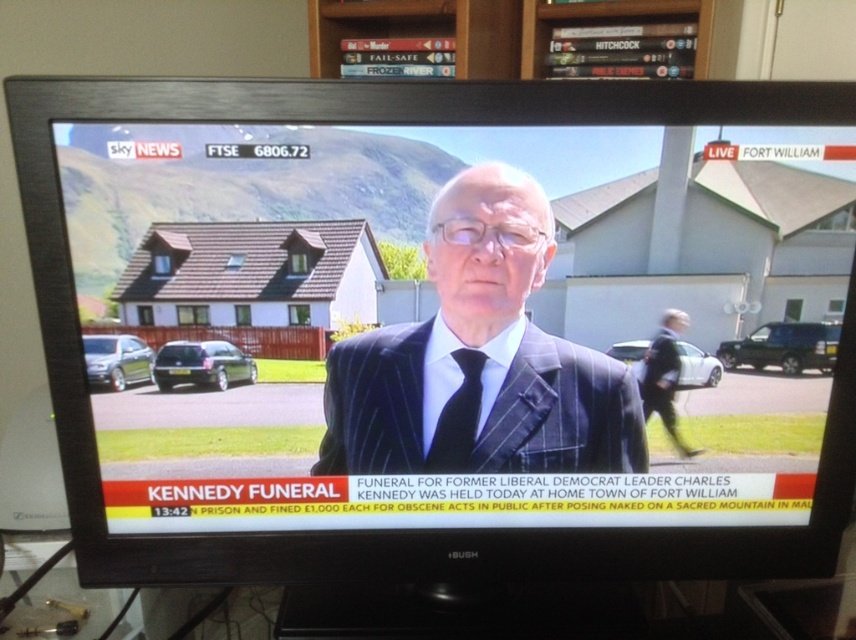
Looking at this image, what is the exact coordinate of the pinstriped suit at center?

The pinstriped suit at center is located at coordinate point [479,358].

You are a tailor observing a news broadcast on a television screen. You notice a pinstriped suit at center and a black silk tie at center. Which item appears larger in the image?

The pinstriped suit at center is taller than the black silk tie at center, so it appears larger in the image.

You are a camera operator adjusting the focus on the television screen. You need to ensure both the pinstriped suit at center and the black silk tie at center are in focus. Which object should you adjust the focus for first to ensure both are clear?

The pinstriped suit at center is closer to the viewer than the black silk tie at center. To ensure both are in focus, adjust the focus starting with the pinstriped suit at center first, as it is closer, and then adjust for the black silk tie at center which is further away.